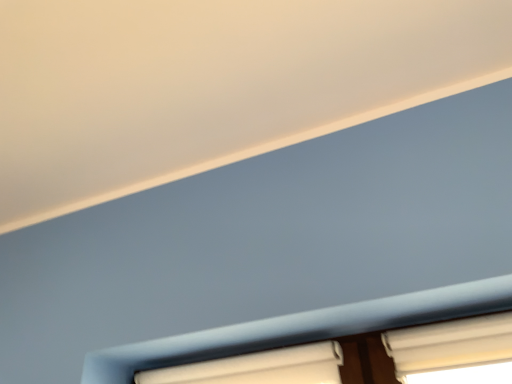
Question: Visually, is white matte window at lower center, which appears as the first window when viewed from the left, positioned to the left or to the right of white textured blinds at lower right, which is the second window from left to right?

Choices:
 (A) right
 (B) left

Answer: (B)

Question: From a real-world perspective, is white matte window at lower center, which appears as the first window when viewed from the left, above or below white textured blinds at lower right, the first window positioned from the right?

Choices:
 (A) below
 (B) above

Answer: (B)

Question: Looking at the image, does white matte window at lower center, which appears as the first window when viewed from the left, seem bigger or smaller compared to white textured blinds at lower right, which is the second window from left to right?

Choices:
 (A) big
 (B) small

Answer: (A)

Question: From a real-world perspective, relative to white matte window at lower center, which is the second window from right to left, is white textured blinds at lower right, the first window positioned from the right, vertically above or below?

Choices:
 (A) above
 (B) below

Answer: (B)

Question: Is point (390, 347) closer or farther from the camera than point (301, 364)?

Choices:
 (A) closer
 (B) farther

Answer: (A)

Question: Is white textured blinds at lower right, which is the second window from left to right, wider or thinner than white matte window at lower center, which is the second window from right to left?

Choices:
 (A) wide
 (B) thin

Answer: (A)

Question: Is white textured blinds at lower right, the first window positioned from the right, inside the boundaries of white matte window at lower center, which appears as the first window when viewed from the left, or outside?

Choices:
 (A) outside
 (B) inside

Answer: (A)